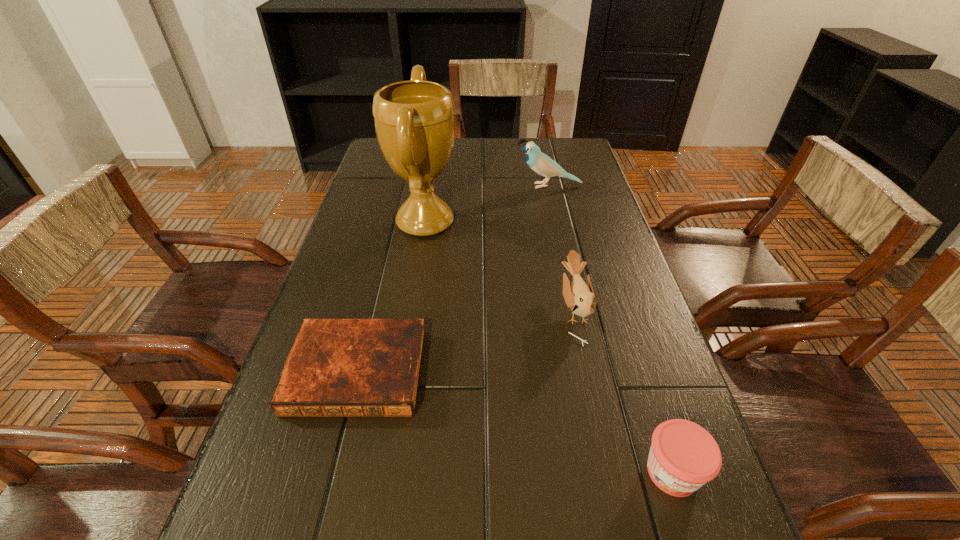
The width and height of the screenshot is (960, 540). I want to click on blank region between the fourth tallest object and the tallest object, so click(549, 347).

In order to click on empty location between the third shortest object and the award in this screenshot , I will do (500, 266).

Select which object is the closest to the shortest object. Please provide its 2D coordinates. Your answer should be formatted as a tuple, i.e. [(x, y)], where the tuple contains the x and y coordinates of a point satisfying the conditions above.

[(414, 120)]

Identify the location of object that is the closest to the jam. The height and width of the screenshot is (540, 960). (579, 297).

The height and width of the screenshot is (540, 960). In order to click on free spot that satisfies the following two spatial constraints: 1. at the face of the fourth shortest object; 2. on the spine side of the Bible in this screenshot , I will do `click(590, 371)`.

I want to click on free spot that satisfies the following two spatial constraints: 1. at the face of the second tallest object; 2. on the spine side of the shortest object, so click(590, 371).

You are a GUI agent. You are given a task and a screenshot of the screen. Output one action in this format:
    pyautogui.click(x=<x>, y=<y>)
    Task: Click on the vacant area in the image that satisfies the following two spatial constraints: 1. on the front of the tallest object with the decoration; 2. on the spine side of the Bible
    
    Given the screenshot: What is the action you would take?
    pyautogui.click(x=401, y=371)

This screenshot has height=540, width=960. In order to click on free location that satisfies the following two spatial constraints: 1. on the front of the award with the decoration; 2. on the spine side of the Bible in this screenshot , I will do `click(401, 371)`.

You are a GUI agent. You are given a task and a screenshot of the screen. Output one action in this format:
    pyautogui.click(x=<x>, y=<y>)
    Task: Click on the vacant space that satisfies the following two spatial constraints: 1. at the beak of the nearer bird; 2. on the spine side of the Bible
    
    Given the screenshot: What is the action you would take?
    pyautogui.click(x=588, y=371)

At what (x,y) coordinates should I click in order to perform the action: click on free space that satisfies the following two spatial constraints: 1. at the face of the farther bird; 2. on the spine side of the Bible. Please return your answer as a coordinate pair (x, y). Looking at the image, I should click on (590, 371).